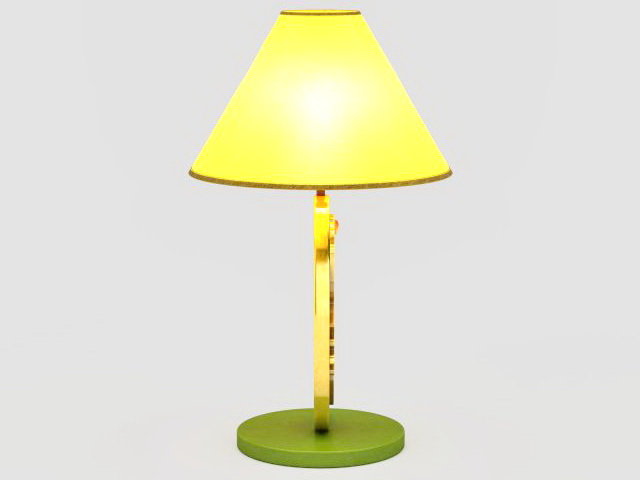
Locate an element on the screen. The image size is (640, 480). lamp is located at coordinates (322, 326).